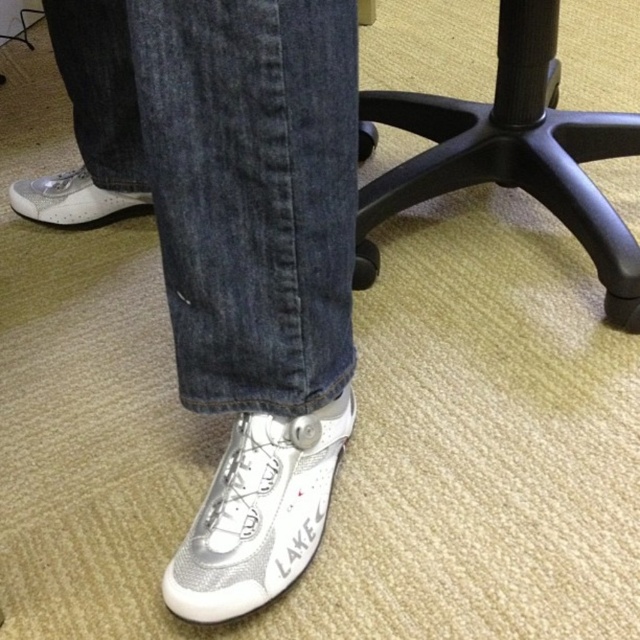
You are standing in an office and see two points marked on the floor. The first point is at coordinates point (358, 272) and the second point is at point (317, 534). Which point is closer to you?

Point (358, 272) is further to the camera than point (317, 534), so the point closer to you is point (317, 534).

You are organizing a shoe display in an office. You have two white mesh shoes to place on the floor. The white mesh shoe at center and the white mesh shoe at lower left. According to the image, which shoe should be placed lower on the display rack?

The white mesh shoe at center should be placed lower on the display rack because it is located below the white mesh shoe at lower left in the image.

You are organizing a space and need to move the white mesh shoe at lower center to a different location. Which direction should you move it so that it is no longer under the black plastic chair at center?

The black plastic chair at center is located above the white mesh shoe at lower center, so moving the white mesh shoe at lower center away from under the chair would require moving it in any direction except upward, as the chair is above it. However, since the shoe is on the floor, you should move it sideways or backward to a position where it is no longer beneath the chair.